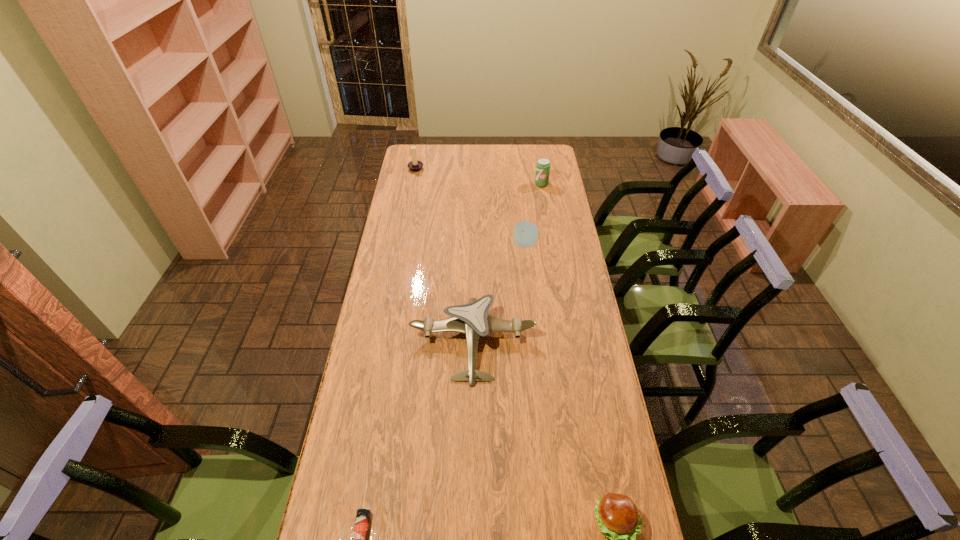
Where is `object that is at the right edge`? object that is at the right edge is located at coordinates (543, 165).

Image resolution: width=960 pixels, height=540 pixels. Identify the location of object present at the far left corner. (415, 166).

In the image, there is a desktop. Identify the location of vacant space at the far edge. The image size is (960, 540). (466, 167).

Identify the location of free space at the left edge. (391, 231).

Locate an element on the screen. vacant space at the right edge of the desktop is located at coordinates (553, 174).

This screenshot has height=540, width=960. I want to click on vacant area that lies between the apple and the second farthest object, so click(533, 214).

You are a GUI agent. You are given a task and a screenshot of the screen. Output one action in this format:
    pyautogui.click(x=<x>, y=<y>)
    Task: Click on the free space between the third farthest object and the farthest object
    The height and width of the screenshot is (540, 960).
    Given the screenshot: What is the action you would take?
    pyautogui.click(x=470, y=206)

You are a GUI agent. You are given a task and a screenshot of the screen. Output one action in this format:
    pyautogui.click(x=<x>, y=<y>)
    Task: Click on the free space between the candle holder and the second farthest object
    The width and height of the screenshot is (960, 540).
    Given the screenshot: What is the action you would take?
    pyautogui.click(x=479, y=176)

Where is `vacant space in between the soda and the third farthest object`? vacant space in between the soda and the third farthest object is located at coordinates (533, 214).

The width and height of the screenshot is (960, 540). I want to click on empty location between the apple and the second farthest object, so pyautogui.click(x=533, y=214).